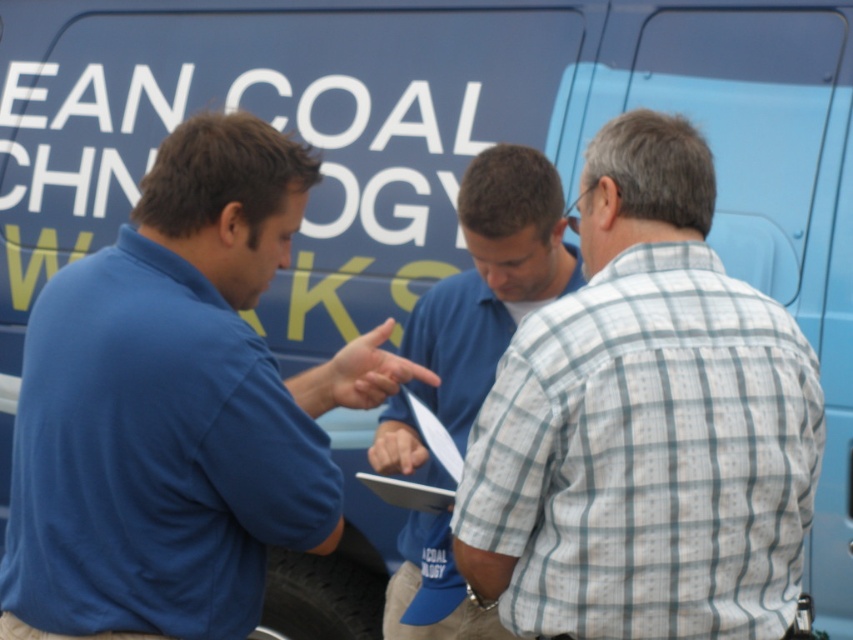
Question: Can you confirm if light gray checkered shirt at center is bigger than white paper clipboard at center?

Choices:
 (A) yes
 (B) no

Answer: (A)

Question: Does blue cotton shirt at left appear on the left side of blue shirt at center?

Choices:
 (A) no
 (B) yes

Answer: (B)

Question: Which point is farther to the camera?

Choices:
 (A) light gray checkered shirt at center
 (B) white paper clipboard at center

Answer: (B)

Question: Among these objects, which one is nearest to the camera?

Choices:
 (A) light gray checkered shirt at center
 (B) white paper clipboard at center

Answer: (A)

Question: Is light gray checkered shirt at center behind white paper clipboard at center?

Choices:
 (A) yes
 (B) no

Answer: (B)

Question: Which object is closer to the camera taking this photo?

Choices:
 (A) light gray checkered shirt at center
 (B) blue shirt at center
 (C) white paper clipboard at center

Answer: (A)